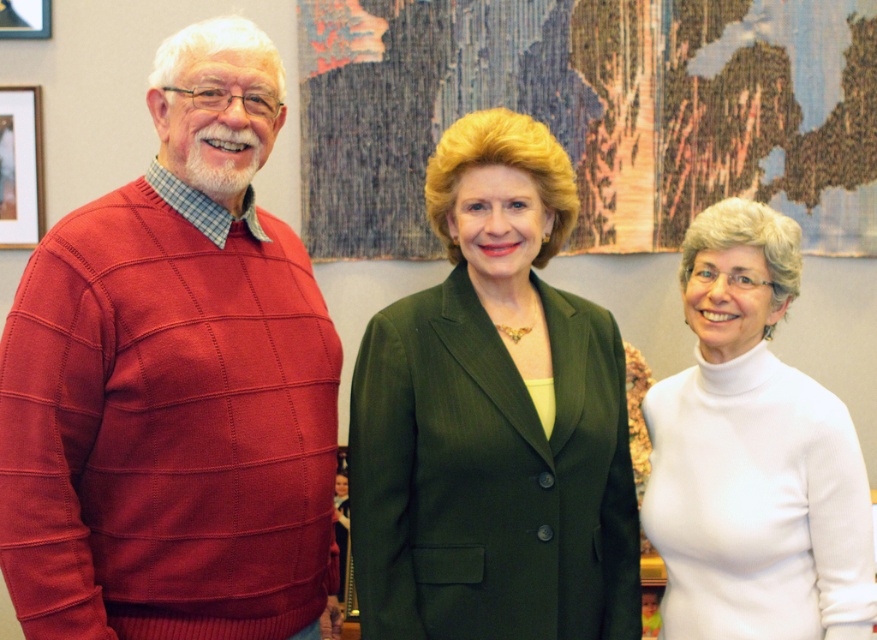
Question: Which point is closer to the camera?

Choices:
 (A) (2, 152)
 (B) (8, 22)

Answer: (B)

Question: Can you confirm if knit sweater at left is positioned below white turtleneck sweater at center?

Choices:
 (A) no
 (B) yes

Answer: (A)

Question: Which object appears closest to the camera in this image?

Choices:
 (A) knit sweater at left
 (B) wooden picture frame at left

Answer: (A)

Question: Is the position of green pinstripe suit at center more distant than that of white turtleneck sweater at center?

Choices:
 (A) no
 (B) yes

Answer: (A)

Question: Which point is farther from the camera taking this photo?

Choices:
 (A) (682, 568)
 (B) (27, 164)
 (C) (512, 627)

Answer: (B)

Question: Is knit sweater at left in front of brushed metal picture frame at upper left?

Choices:
 (A) yes
 (B) no

Answer: (A)